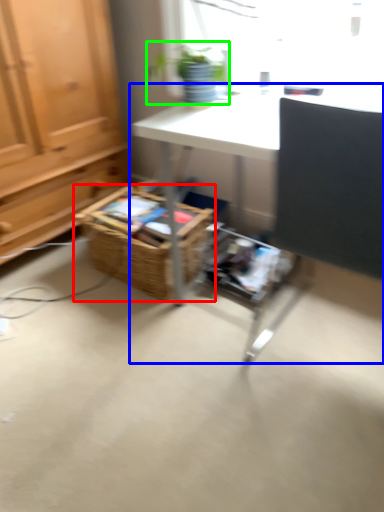
Question: Based on their relative distances, which object is farther from basket (highlighted by a red box)? Choose from desk (highlighted by a blue box) and houseplant (highlighted by a green box).

Choices:
 (A) desk
 (B) houseplant

Answer: (B)